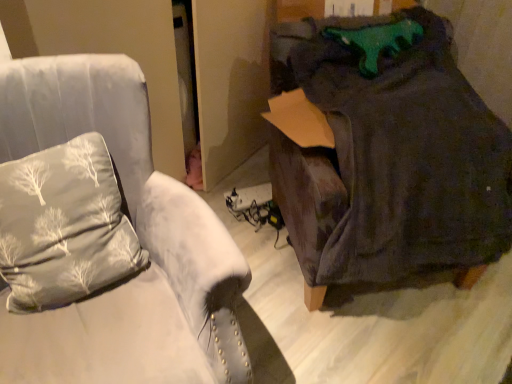
Question: From their relative heights in the image, would you say dark gray fabric bean bag at right is taller or shorter than velvet gray armchair at left?

Choices:
 (A) tall
 (B) short

Answer: (B)

Question: In the image, is dark gray fabric bean bag at right positioned in front of or behind velvet gray armchair at left?

Choices:
 (A) behind
 (B) front

Answer: (A)

Question: Based on their relative distances, which object is nearer to the dark gray fabric bean bag at right?

Choices:
 (A) silky gray pillow at left
 (B) velvet gray armchair at left

Answer: (B)

Question: Considering the real-world distances, which object is farthest from the dark gray fabric bean bag at right?

Choices:
 (A) velvet gray armchair at left
 (B) silky gray pillow at left

Answer: (B)